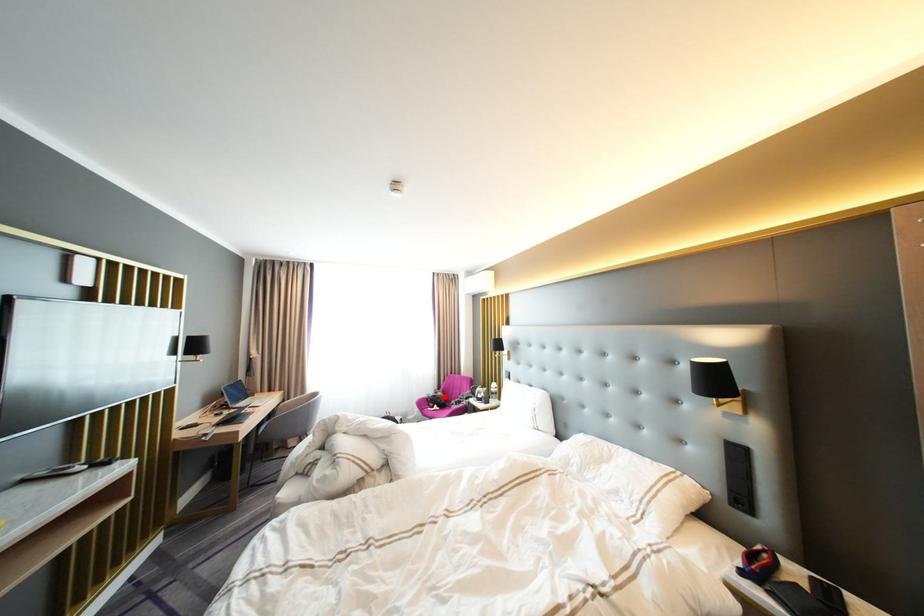
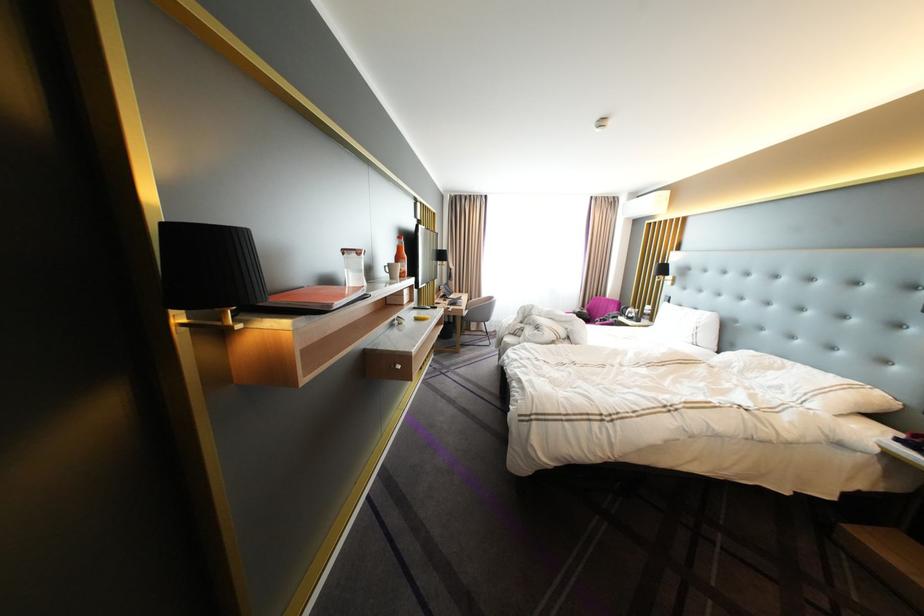
Question: I am providing you with two images of the same scene from different viewpoints. Image1 has a red point marked. In image2, the corresponding 3D location appears at what relative position? Reply with the corresponding letter.

Choices:
 (A) Closer
 (B) Farther

Answer: (B)